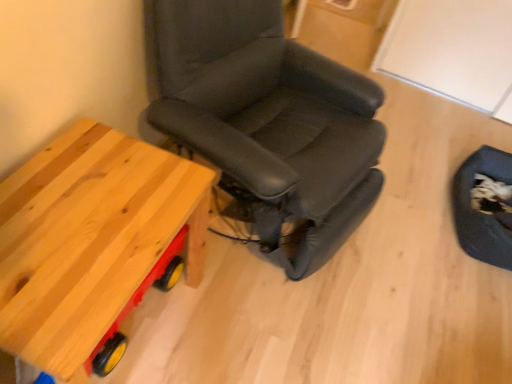
Where is `free space that is in between natural wood table at left and dark blue fabric swivel chair at lower right`? The image size is (512, 384). free space that is in between natural wood table at left and dark blue fabric swivel chair at lower right is located at coordinates (352, 276).